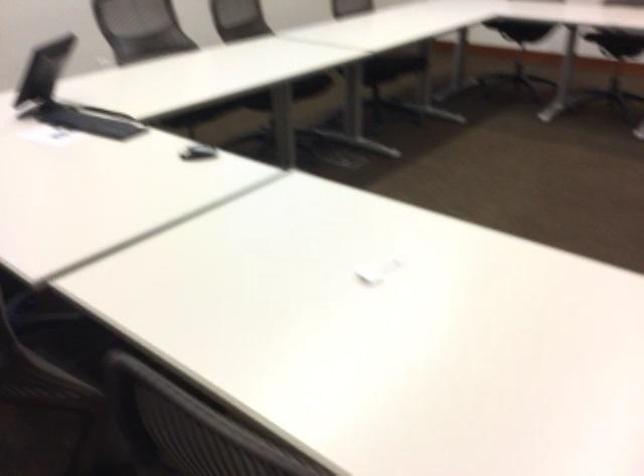
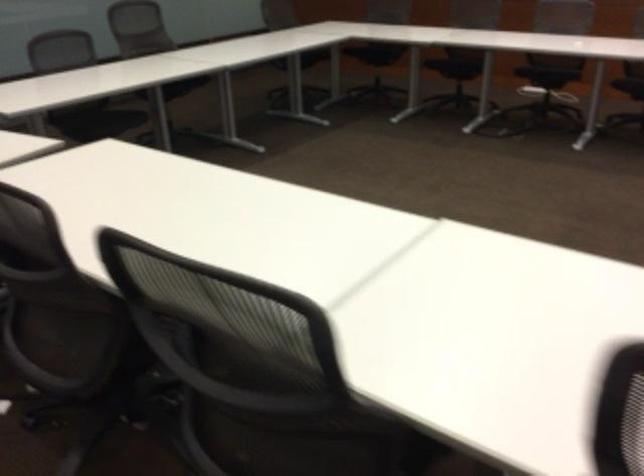
The images are taken continuously from a first-person perspective. In which direction is your viewpoint rotating?

The camera's rotation is toward right-down.